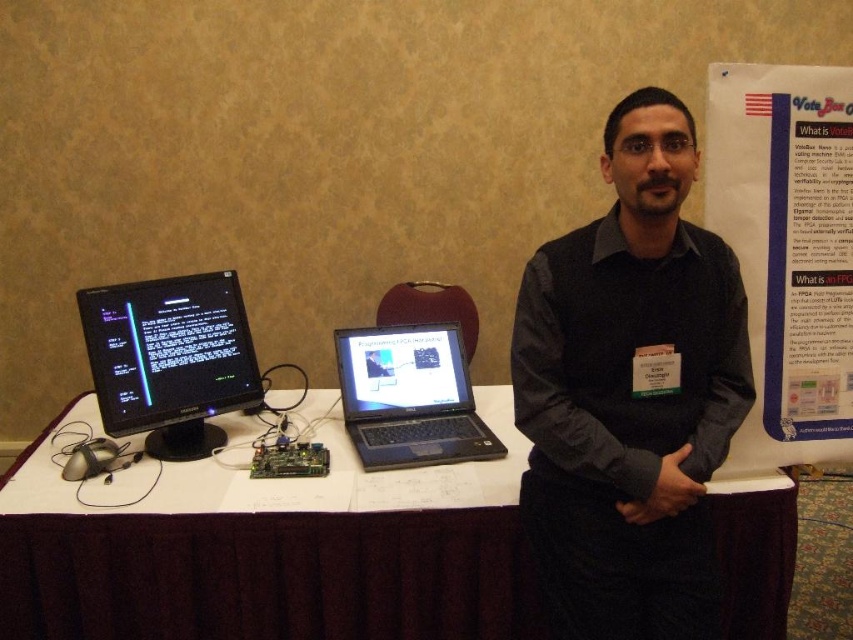
Question: Is white paper at upper right further to camera compared to black glossy laptop at center?

Choices:
 (A) yes
 (B) no

Answer: (B)

Question: Which object is closer to the camera taking this photo?

Choices:
 (A) black matte shirt at center
 (B) black glossy laptop at center
 (C) white paper at upper right

Answer: (A)

Question: Is black glossy monitor at left above black glossy laptop at center?

Choices:
 (A) yes
 (B) no

Answer: (A)

Question: Which object appears farthest from the camera in this image?

Choices:
 (A) black glossy monitor at left
 (B) white paper at upper right
 (C) black glossy laptop at center

Answer: (A)

Question: Which object is positioned farthest from the black matte shirt at center?

Choices:
 (A) white paper at upper right
 (B) black glossy monitor at left
 (C) black glossy laptop at center

Answer: (B)

Question: Does black glossy monitor at left lie in front of black glossy laptop at center?

Choices:
 (A) yes
 (B) no

Answer: (B)